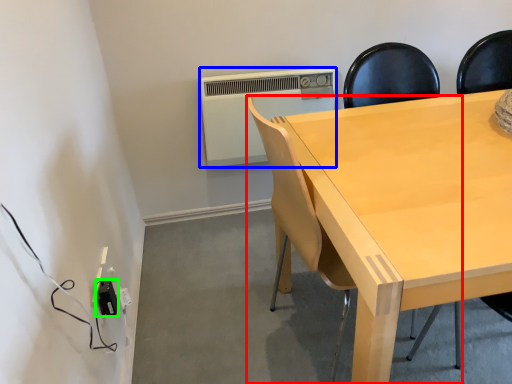
Question: Estimate the real-world distances between objects in this image. Which object is closer to chair (highlighted by a red box), air conditioning (highlighted by a blue box) or electric outlet (highlighted by a green box)?

Choices:
 (A) air conditioning
 (B) electric outlet

Answer: (B)